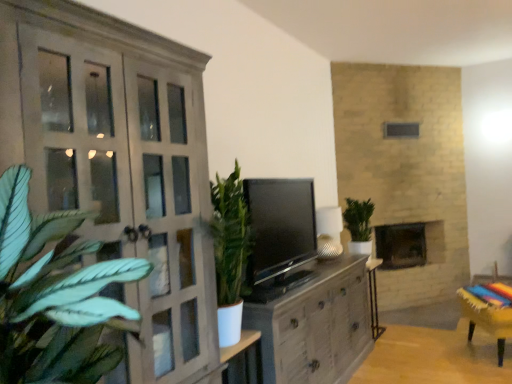
Question: Is wooden table at lower right, the first table positioned from the bottom, a part of dark gray stone fireplace at center?

Choices:
 (A) yes
 (B) no

Answer: (B)

Question: Can you confirm if dark gray stone fireplace at center is bigger than wooden table at lower right, the 2th table in the back-to-front sequence?

Choices:
 (A) no
 (B) yes

Answer: (B)

Question: Is dark gray stone fireplace at center further to the viewer compared to wooden table at lower right, which is the second table in left-to-right order?

Choices:
 (A) yes
 (B) no

Answer: (A)

Question: From a real-world perspective, is dark gray stone fireplace at center positioned under wooden table at lower right, placed as the 1th table when sorted from front to back, based on gravity?

Choices:
 (A) yes
 (B) no

Answer: (B)

Question: Is wooden table at lower right, the 2th table in the back-to-front sequence, at the back of dark gray stone fireplace at center?

Choices:
 (A) no
 (B) yes

Answer: (A)

Question: In the image, is wooden stool at lower right positioned in front of or behind matte gray cabinet at center?

Choices:
 (A) behind
 (B) front

Answer: (A)

Question: Would you say wooden stool at lower right is to the left or to the right of matte gray cabinet at center in the picture?

Choices:
 (A) left
 (B) right

Answer: (B)

Question: From their relative heights in the image, would you say wooden stool at lower right is taller or shorter than matte gray cabinet at center?

Choices:
 (A) short
 (B) tall

Answer: (A)

Question: Considering the positions of wooden stool at lower right and matte gray cabinet at center in the image, is wooden stool at lower right wider or thinner than matte gray cabinet at center?

Choices:
 (A) wide
 (B) thin

Answer: (A)

Question: Considering their positions, is matte gray cupboard at left located in front of or behind black glossy tv at center?

Choices:
 (A) behind
 (B) front

Answer: (B)

Question: From the image's perspective, relative to black glossy tv at center, is matte gray cupboard at left above or below?

Choices:
 (A) below
 (B) above

Answer: (B)

Question: Considering the positions of matte gray cupboard at left and black glossy tv at center in the image, is matte gray cupboard at left taller or shorter than black glossy tv at center?

Choices:
 (A) tall
 (B) short

Answer: (A)

Question: From a real-world perspective, is matte gray cupboard at left physically located above or below black glossy tv at center?

Choices:
 (A) below
 (B) above

Answer: (B)

Question: Looking at their shapes, would you say matte gray cupboard at left is wider or thinner than matte gray cabinet at center?

Choices:
 (A) thin
 (B) wide

Answer: (A)

Question: From the image's perspective, is matte gray cupboard at left located above or below matte gray cabinet at center?

Choices:
 (A) below
 (B) above

Answer: (B)